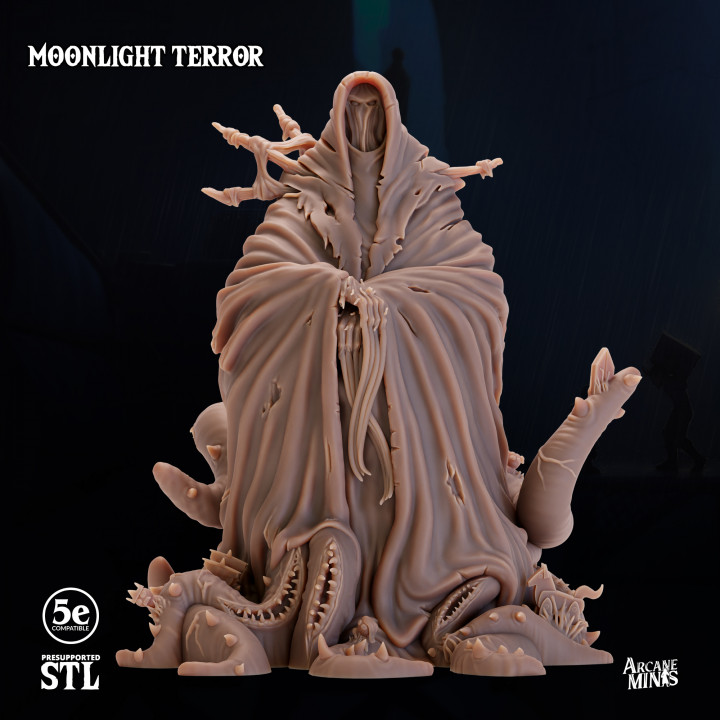
What are the coordinates of `toy ship` in the screenshot? It's located at (225, 569), (228, 559), (235, 580).